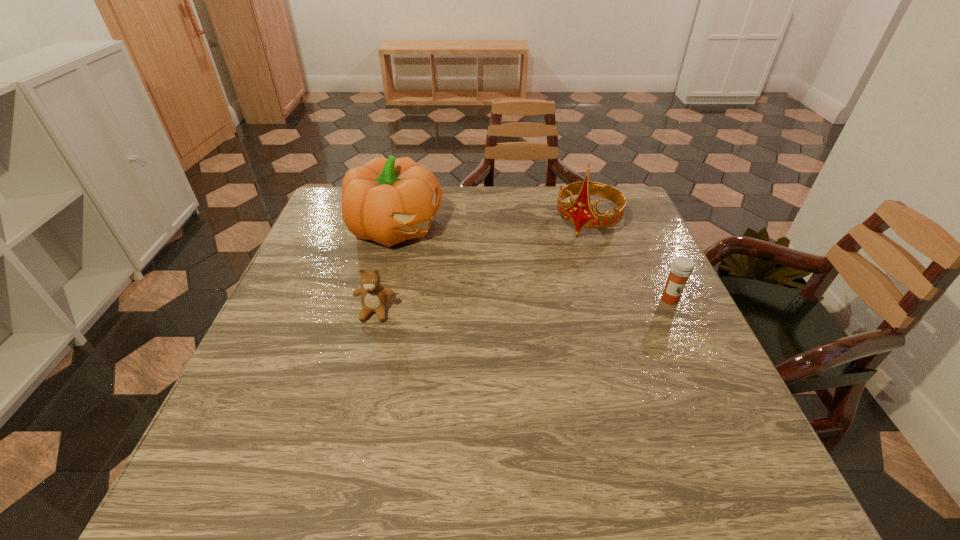
This screenshot has width=960, height=540. I want to click on vacant space on the desktop that is between the teddy bear and the medicine and is positioned on the carved face of the pumpkin, so click(551, 305).

You are a GUI agent. You are given a task and a screenshot of the screen. Output one action in this format:
    pyautogui.click(x=<x>, y=<y>)
    Task: Click on the vacant space on the desktop that is between the teddy bear and the medicine and is positioned on the front-facing side of the second object from right to left
    This screenshot has width=960, height=540.
    Given the screenshot: What is the action you would take?
    pyautogui.click(x=533, y=305)